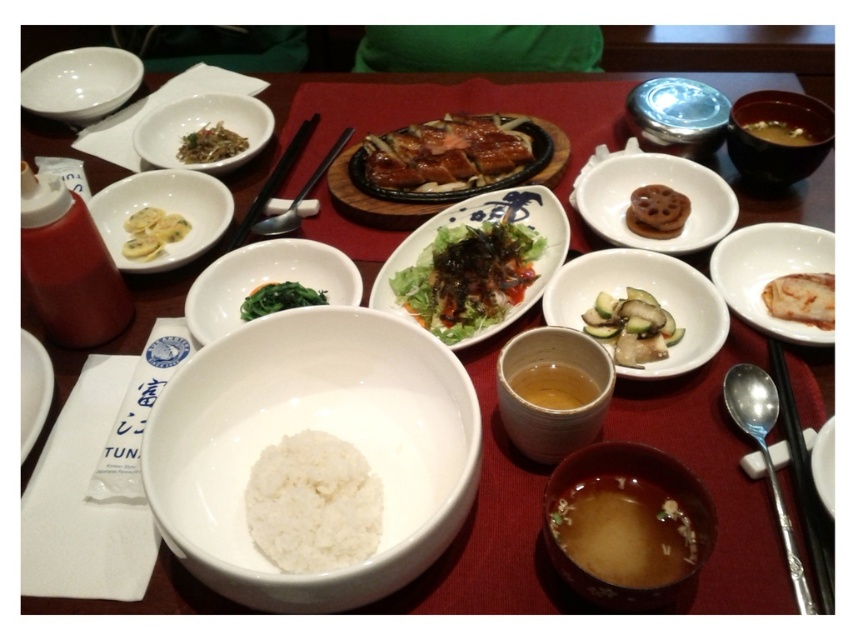
Is white ceramic plate at upper right to the right of white glossy bowl at upper left from the viewer's perspective?

Yes, white ceramic plate at upper right is to the right of white glossy bowl at upper left.

Does white ceramic plate at upper right have a lesser height compared to white glossy bowl at upper left?

Indeed, white ceramic plate at upper right has a lesser height compared to white glossy bowl at upper left.

Is point (735, 268) positioned before point (67, 54)?

Yes, it is in front of point (67, 54).

This screenshot has height=640, width=853. What are the coordinates of `white ceramic plate at upper right` in the screenshot? It's located at 770,272.

Between white ceramic bowl at center and white glossy fish at right, which one has more height?

white ceramic bowl at center

Who is more distant from viewer, (566, 307) or (824, 308)?

Positioned behind is point (566, 307).

Which is behind, point (625, 371) or point (822, 326)?

Point (822, 326)

Locate an element on the screen. The height and width of the screenshot is (640, 853). white ceramic bowl at center is located at coordinates (651, 292).

Is point (125, 260) more distant than point (204, 132)?

No, (125, 260) is in front of (204, 132).

Based on the photo, how far apart are white matte dumplings at center left and green shredded vegetables at upper left?

white matte dumplings at center left and green shredded vegetables at upper left are 4.73 inches apart.

Describe the element at coordinates (165, 211) in the screenshot. The width and height of the screenshot is (853, 640). I see `white matte dumplings at center left` at that location.

Locate an element on the screen. white matte dumplings at center left is located at coordinates 165,211.